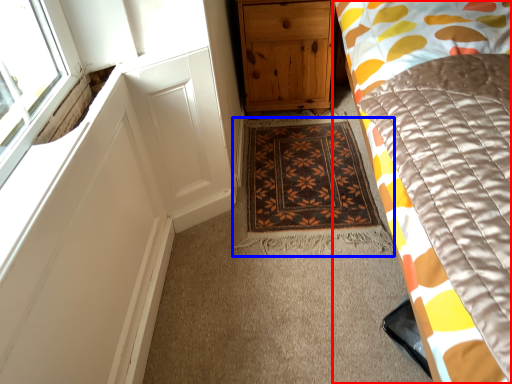
Question: Which object appears closest to the camera in this image, bed (highlighted by a red box) or mat (highlighted by a blue box)?

Choices:
 (A) bed
 (B) mat

Answer: (A)